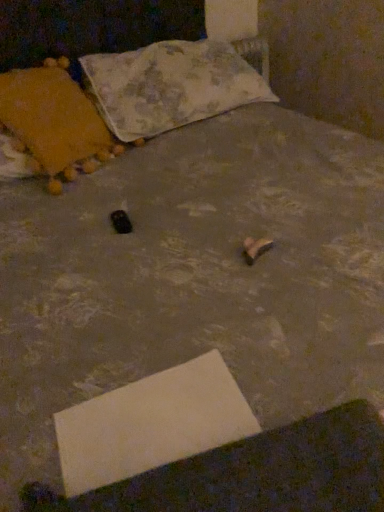
Image resolution: width=384 pixels, height=512 pixels. I want to click on vacant area on top of white cardboard at lower center (from a real-world perspective), so click(152, 422).